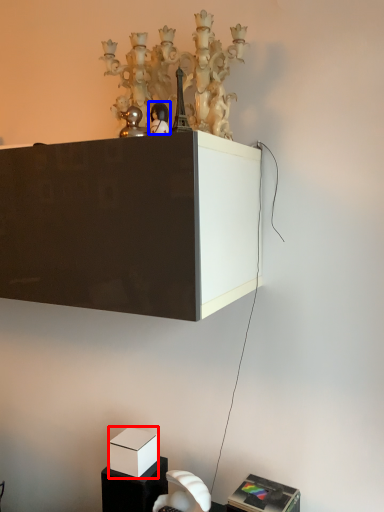
Question: Which object appears farthest to the camera in this image, box (highlighted by a red box) or toy (highlighted by a blue box)?

Choices:
 (A) box
 (B) toy

Answer: (A)